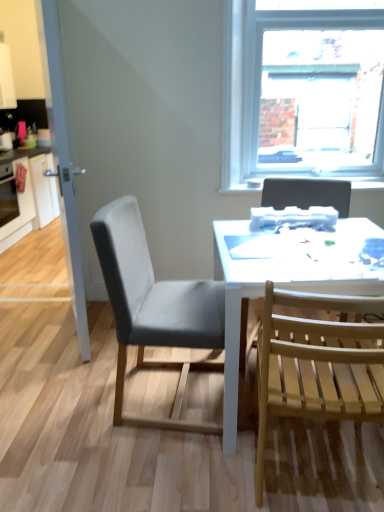
Question: Is clear glass door at left next to brushed metal oven at left?

Choices:
 (A) no
 (B) yes

Answer: (A)

Question: Is clear glass door at left not near brushed metal oven at left?

Choices:
 (A) no
 (B) yes

Answer: (B)

Question: Does clear glass door at left have a greater width compared to brushed metal oven at left?

Choices:
 (A) no
 (B) yes

Answer: (A)

Question: Is clear glass door at left positioned with its back to brushed metal oven at left?

Choices:
 (A) yes
 (B) no

Answer: (B)

Question: From a real-world perspective, is clear glass door at left beneath brushed metal oven at left?

Choices:
 (A) yes
 (B) no

Answer: (B)

Question: Is white glossy desk at center in front of or behind brushed metal oven at left in the image?

Choices:
 (A) front
 (B) behind

Answer: (A)

Question: Is point (316, 243) closer or farther from the camera than point (0, 197)?

Choices:
 (A) farther
 (B) closer

Answer: (B)

Question: Is white glossy desk at center bigger or smaller than brushed metal oven at left?

Choices:
 (A) big
 (B) small

Answer: (A)

Question: Visually, is white glossy desk at center positioned to the left or to the right of brushed metal oven at left?

Choices:
 (A) left
 (B) right

Answer: (B)

Question: Is point (319, 224) positioned closer to the camera than point (322, 190)?

Choices:
 (A) farther
 (B) closer

Answer: (B)

Question: From a real-world perspective, is white plastic printer at upper center positioned above or below wooden slats chair at right, the 3th chair in the left-to-right sequence?

Choices:
 (A) below
 (B) above

Answer: (B)

Question: Based on their positions, is white plastic printer at upper center located to the left or right of wooden slats chair at right, the first chair from the right?

Choices:
 (A) left
 (B) right

Answer: (A)

Question: Considering the positions of white plastic printer at upper center and wooden slats chair at right, the 3th chair in the left-to-right sequence, in the image, is white plastic printer at upper center bigger or smaller than wooden slats chair at right, the 3th chair in the left-to-right sequence,?

Choices:
 (A) small
 (B) big

Answer: (A)

Question: Considering the relative positions of white plastic printer at upper center and light wood slats chair at right, the second chair positioned from the left, in the image provided, is white plastic printer at upper center to the left or to the right of light wood slats chair at right, the second chair positioned from the left,?

Choices:
 (A) right
 (B) left

Answer: (A)

Question: From a real-world perspective, is white plastic printer at upper center positioned above or below light wood slats chair at right, which is the 2th chair from right to left?

Choices:
 (A) below
 (B) above

Answer: (B)